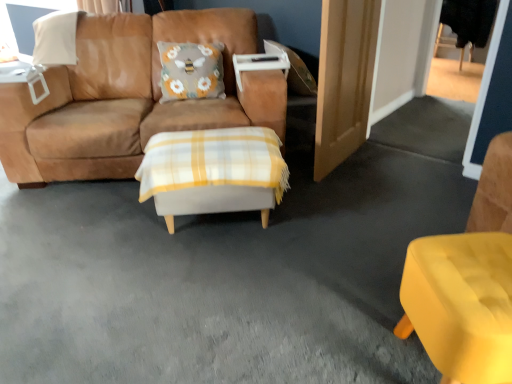
Where is `free space in front of wooden door at right`? This screenshot has width=512, height=384. free space in front of wooden door at right is located at coordinates (368, 196).